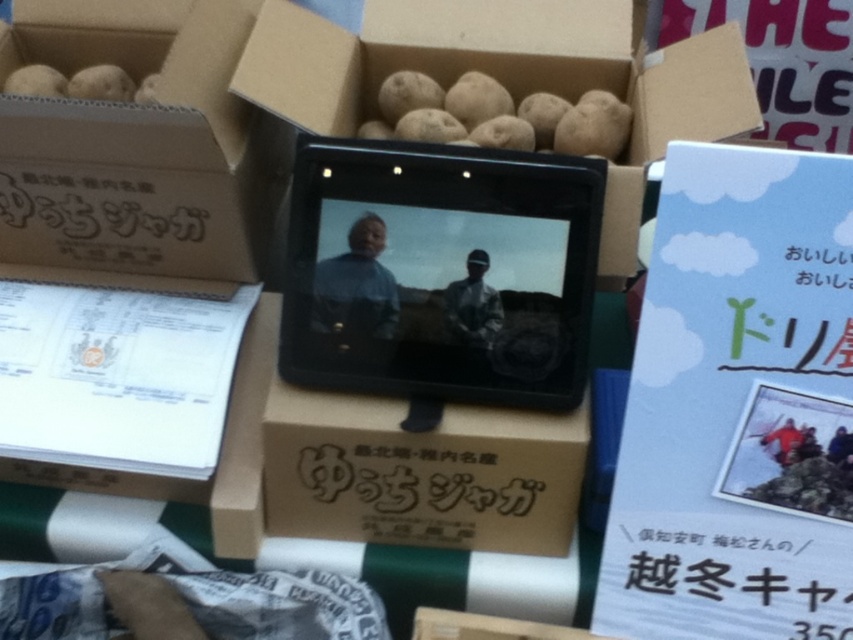
You are standing in front of the potato display and need to locate two specific points marked in the image. The first point is at coordinate point(x=730, y=636) and the second is at point(x=579, y=129). Which point is closer to you?

Point(x=730, y=636) is in front of point(x=579, y=129), so it is closer to you.

Consider the image. You are a delivery person who needs to place a package between the matte cardboard box at center and the white paper at lower right. The package is 16 inches long. Will it fit between them?

The matte cardboard box at center and white paper at lower right are 16.51 inches apart from each other. Since the package is 16 inches long, it will fit between them as there is enough space.

You are organizing a market stall and need to place a new sign that is 1 meter tall. The brown cardboard box at upper left and the white paper at lower right are already present. Based on their heights, which object would allow the new sign to be placed above it without blocking the view?

The brown cardboard box at upper left is taller than the white paper at lower right. Therefore, placing the new sign above the white paper at lower right would be better since it is shorter, allowing the sign to be placed without blocking the view.